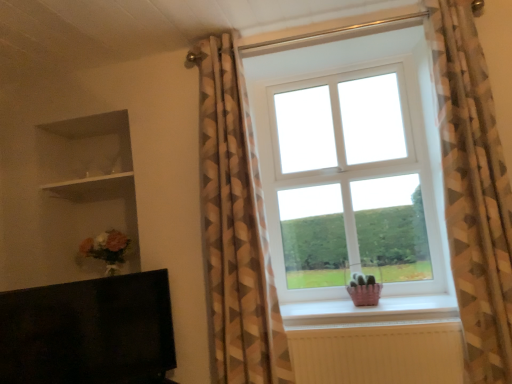
The width and height of the screenshot is (512, 384). Find the location of `white glossy shelf at upper left`. white glossy shelf at upper left is located at coordinates (86, 180).

What is the approximate height of white glossy shelf at upper left?

white glossy shelf at upper left is 1.91 inches tall.

At what (x,y) coordinates should I click in order to perform the action: click on matte pink basket at lower center. Please return your answer as a coordinate pair (x, y). This screenshot has height=384, width=512. Looking at the image, I should click on (369, 310).

Find the location of `black matte tv at lower left`. black matte tv at lower left is located at coordinates (88, 331).

In order to face white plastic window at center, should I rotate leftwards or rightwards?

You should look right and rotate roughly 11.352 degrees.

Measure the distance between geometric-patterned curtain at center, which ranks as the first curtain in left-to-right order, and camera.

The depth of geometric-patterned curtain at center, which ranks as the first curtain in left-to-right order, is 6.75 feet.

Measure the distance between point (225, 124) and camera.

A distance of 7.45 feet exists between point (225, 124) and camera.

The image size is (512, 384). Identify the location of white glossy shelf at upper left. (86, 180).

Can you tell me how much black matte tv at lower left and white glossy shelf at upper left differ in facing direction?

black matte tv at lower left and white glossy shelf at upper left are facing 52.9 degrees away from each other.

Is white glossy shelf at upper left a part of black matte tv at lower left?

No, white glossy shelf at upper left is not inside black matte tv at lower left.

Does point (145, 338) come farther from viewer compared to point (65, 186)?

No, (145, 338) is in front of (65, 186).

Is black matte tv at lower left bigger than white glossy shelf at upper left?

Indeed, black matte tv at lower left has a larger size compared to white glossy shelf at upper left.

In the scene shown: Does geometric-patterned curtain at right, which is the second curtain from left to right, have a lesser height compared to geometric-patterned curtain at center, which appears as the 2th curtain when viewed from the right?

In fact, geometric-patterned curtain at right, which is the second curtain from left to right, may be taller than geometric-patterned curtain at center, which appears as the 2th curtain when viewed from the right.

Is geometric-patterned curtain at center, which ranks as the first curtain in left-to-right order, completely or partially inside geometric-patterned curtain at right, the first curtain positioned from the right?

No, geometric-patterned curtain at center, which ranks as the first curtain in left-to-right order, is not a part of geometric-patterned curtain at right, the first curtain positioned from the right.

Does point (459, 129) lie in front of point (280, 364)?

That is True.

Does geometric-patterned curtain at right, the first curtain positioned from the right, have a smaller size compared to geometric-patterned curtain at center, which ranks as the first curtain in left-to-right order?

Indeed, geometric-patterned curtain at right, the first curtain positioned from the right, has a smaller size compared to geometric-patterned curtain at center, which ranks as the first curtain in left-to-right order.

Is matte pink basket at lower center positioned far away from geometric-patterned curtain at right, the first curtain positioned from the right?

No, matte pink basket at lower center is not far from geometric-patterned curtain at right, the first curtain positioned from the right.

From the image's perspective, who appears lower, matte pink basket at lower center or geometric-patterned curtain at right, which is the second curtain from left to right?

matte pink basket at lower center appears lower in the image.

Is matte pink basket at lower center turned away from geometric-patterned curtain at right, which is the second curtain from left to right?

That's not correct — matte pink basket at lower center is not looking away from geometric-patterned curtain at right, which is the second curtain from left to right.

How many degrees apart are the facing directions of black matte tv at lower left and geometric-patterned curtain at center, which appears as the 2th curtain when viewed from the right?

They differ by 53.1 degrees in their facing directions.

Is point (55, 347) farther from viewer compared to point (237, 110)?

No.

From the image's perspective, which object appears higher, black matte tv at lower left or geometric-patterned curtain at center, which appears as the 2th curtain when viewed from the right?

geometric-patterned curtain at center, which appears as the 2th curtain when viewed from the right, from the image's perspective.

Consider the image. Looking at their sizes, would you say black matte tv at lower left is wider or thinner than geometric-patterned curtain at center, which appears as the 2th curtain when viewed from the right?

Considering their sizes, black matte tv at lower left looks slimmer than geometric-patterned curtain at center, which appears as the 2th curtain when viewed from the right.

Is point (290, 313) farther from camera compared to point (68, 183)?

No, it is not.

Between white plastic window at center and white glossy shelf at upper left, which one has more height?

With more height is white plastic window at center.

Image resolution: width=512 pixels, height=384 pixels. In order to click on shelf located below the white plastic window at center (from the image's perspective) in this screenshot , I will do `click(86, 180)`.

Between matte pink basket at lower center and white plastic window at center, which one appears on the left side from the viewer's perspective?

From the viewer's perspective, white plastic window at center appears more on the left side.

Based on the photo, could white plastic window at center be considered to be inside matte pink basket at lower center?

No, white plastic window at center is not surrounded by matte pink basket at lower center.

Choose the correct answer: Is black matte tv at lower left inside geometric-patterned curtain at right, the first curtain positioned from the right, or outside it?

The correct answer is: outside.

Can you confirm if black matte tv at lower left is smaller than geometric-patterned curtain at right, which is the second curtain from left to right?

Yes.

From the image's perspective, is black matte tv at lower left below geometric-patterned curtain at right, which is the second curtain from left to right?

Correct, black matte tv at lower left appears lower than geometric-patterned curtain at right, which is the second curtain from left to right, in the image.

Find the location of a particular element. This screenshot has width=512, height=384. shelf located above the black matte tv at lower left (from a real-world perspective) is located at coordinates (86, 180).

In the image, there is a geometric-patterned curtain at right, the first curtain positioned from the right. Where is `curtain below it (from the image's perspective)`? The image size is (512, 384). curtain below it (from the image's perspective) is located at coordinates (234, 228).

Based on the photo, which object lies nearer to the anchor point black matte tv at lower left, geometric-patterned curtain at center, which appears as the 2th curtain when viewed from the right, or white glossy shelf at upper left?

Based on the image, geometric-patterned curtain at center, which appears as the 2th curtain when viewed from the right, appears to be nearer to black matte tv at lower left.

From the image, which object appears to be nearer to matte pink basket at lower center, white glossy shelf at upper left or geometric-patterned curtain at center, which appears as the 2th curtain when viewed from the right?

The object closer to matte pink basket at lower center is geometric-patterned curtain at center, which appears as the 2th curtain when viewed from the right.

Based on their spatial positions, is white glossy shelf at upper left or geometric-patterned curtain at center, which ranks as the first curtain in left-to-right order, closer to geometric-patterned curtain at right, the first curtain positioned from the right?

The object closer to geometric-patterned curtain at right, the first curtain positioned from the right, is geometric-patterned curtain at center, which ranks as the first curtain in left-to-right order.

From the image, which object appears to be nearer to matte pink basket at lower center, white glossy shelf at upper left or white plastic window at center?

Based on the image, white plastic window at center appears to be nearer to matte pink basket at lower center.

Considering their positions, is matte pink basket at lower center positioned closer to white glossy shelf at upper left than geometric-patterned curtain at center, which ranks as the first curtain in left-to-right order?

geometric-patterned curtain at center, which ranks as the first curtain in left-to-right order, is closer to white glossy shelf at upper left.

Considering their positions, is white plastic window at center positioned closer to white glossy shelf at upper left than geometric-patterned curtain at center, which appears as the 2th curtain when viewed from the right?

geometric-patterned curtain at center, which appears as the 2th curtain when viewed from the right, lies closer to white glossy shelf at upper left than the other object.

Based on the photo, looking at the image, which one is located further to geometric-patterned curtain at center, which ranks as the first curtain in left-to-right order, white plastic window at center or matte pink basket at lower center?

Based on the image, matte pink basket at lower center appears to be further to geometric-patterned curtain at center, which ranks as the first curtain in left-to-right order.

Looking at the image, which one is located further to white glossy shelf at upper left, geometric-patterned curtain at center, which ranks as the first curtain in left-to-right order, or matte pink basket at lower center?

Among the two, matte pink basket at lower center is located further to white glossy shelf at upper left.

You are a GUI agent. You are given a task and a screenshot of the screen. Output one action in this format:
    pyautogui.click(x=<x>, y=<y>)
    Task: Click on the furniture located between white glossy shelf at upper left and matte pink basket at lower center in the left-right direction
    
    Given the screenshot: What is the action you would take?
    pyautogui.click(x=88, y=331)

Find the location of a particular element. This screenshot has width=512, height=384. window sill between white glossy shelf at upper left and geometric-patterned curtain at right, which is the second curtain from left to right, in the horizontal direction is located at coordinates (369, 310).

The width and height of the screenshot is (512, 384). I want to click on window sill between geometric-patterned curtain at center, which ranks as the first curtain in left-to-right order, and geometric-patterned curtain at right, the first curtain positioned from the right, from left to right, so click(x=369, y=310).

The width and height of the screenshot is (512, 384). I want to click on window between geometric-patterned curtain at center, which ranks as the first curtain in left-to-right order, and geometric-patterned curtain at right, which is the second curtain from left to right, in the horizontal direction, so click(x=353, y=175).